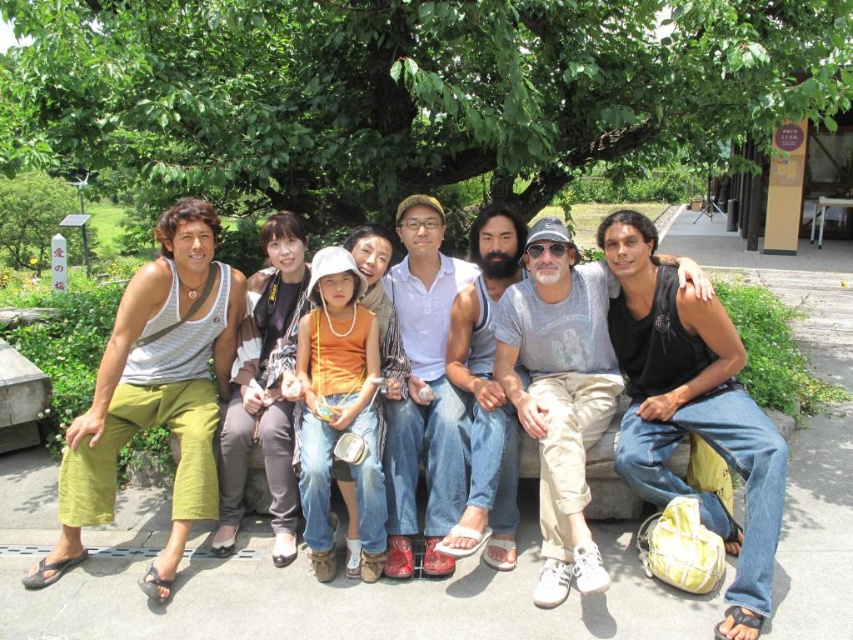
You are planning to set up a picnic blanket in the shaded area under the trees. Which tree, the green leafy tree at upper center or the green leafy tree at left, will provide a wider shaded area for your picnic?

The green leafy tree at upper center will provide a wider shaded area because its width is larger than the green leafy tree at left.

Based on the scene description, which tree is positioned to the right when comparing the green leafy tree at upper center and the green leafy tree at left?

The green leafy tree at upper center is positioned to the right of the green leafy tree at left.